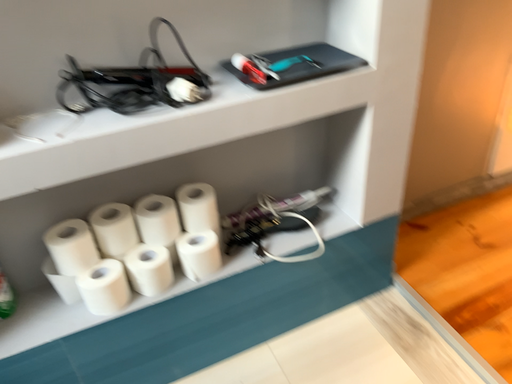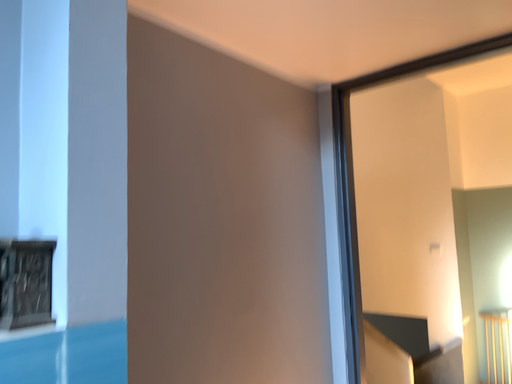
Question: How did the camera likely rotate when shooting the video?

Choices:
 (A) rotated upward
 (B) rotated downward

Answer: (A)